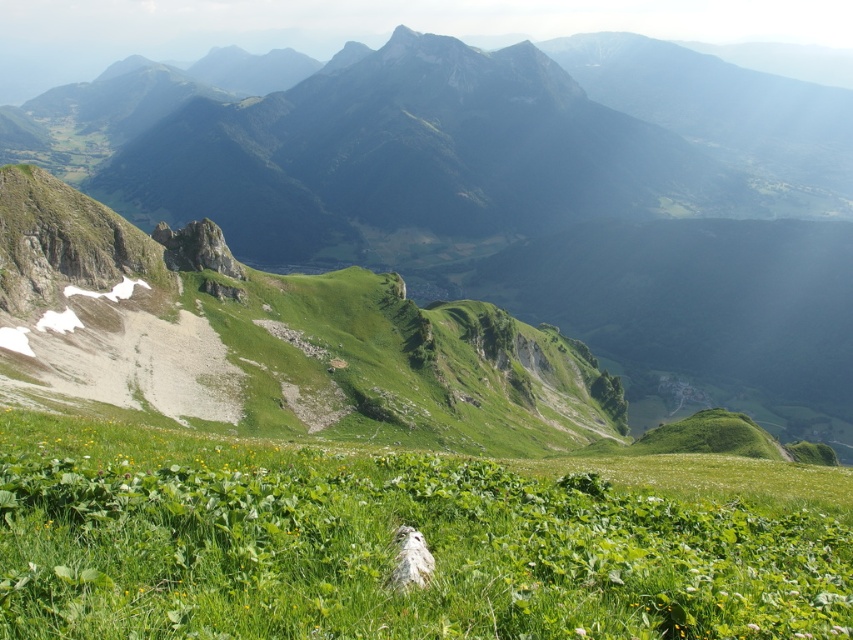
Question: Does green grassy mountain range at center have a greater width compared to green leafy grass at center?

Choices:
 (A) yes
 (B) no

Answer: (A)

Question: Does green grassy mountain range at center appear on the left side of green leafy grass at center?

Choices:
 (A) yes
 (B) no

Answer: (A)

Question: Can you confirm if green grassy mountain range at center is wider than green leafy grass at center?

Choices:
 (A) yes
 (B) no

Answer: (A)

Question: Which of the following is the farthest from the observer?

Choices:
 (A) green leafy grass at center
 (B) green grassy mountain range at center

Answer: (B)